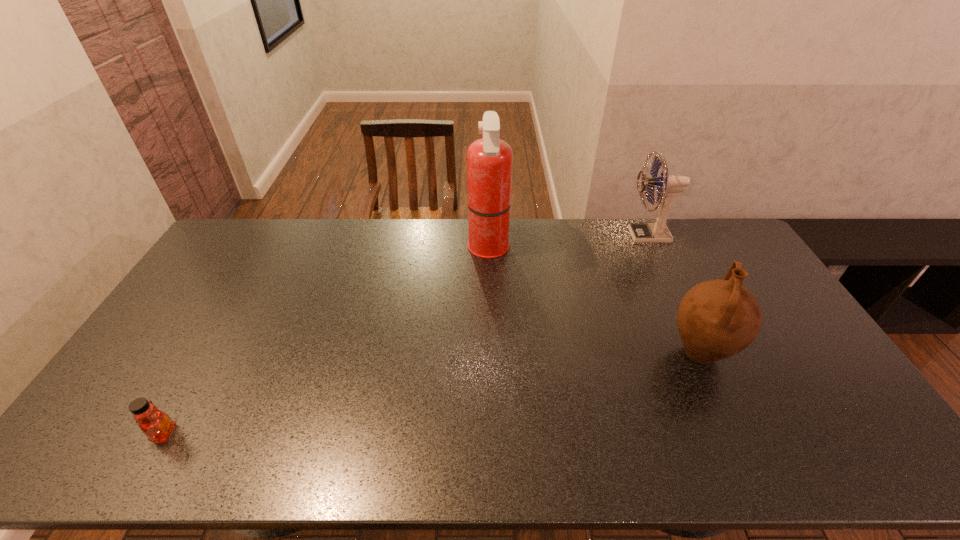
Identify the location of fire extinguisher. The height and width of the screenshot is (540, 960). (489, 160).

Image resolution: width=960 pixels, height=540 pixels. Find the location of `the tallest object`. the tallest object is located at coordinates (489, 160).

The image size is (960, 540). I want to click on fan, so click(x=670, y=185).

The image size is (960, 540). Find the location of `the second nearest object`. the second nearest object is located at coordinates (717, 319).

Find the location of `honey`. honey is located at coordinates (156, 425).

You are a GUI agent. You are given a task and a screenshot of the screen. Output one action in this format:
    pyautogui.click(x=<x>, y=<y>)
    Task: Click on the nearest object
    
    Given the screenshot: What is the action you would take?
    pyautogui.click(x=156, y=425)

Locate an element on the screen. The width and height of the screenshot is (960, 540). vacant space located with the handle and hose on the second object from left to right is located at coordinates (394, 249).

Where is `free point located 0.160m with the handle and hose on the second object from left to right`? free point located 0.160m with the handle and hose on the second object from left to right is located at coordinates (423, 249).

Locate an element on the screen. This screenshot has width=960, height=540. free space located 0.180m with the handle and hose on the second object from left to right is located at coordinates (419, 249).

You are a GUI agent. You are given a task and a screenshot of the screen. Output one action in this format:
    pyautogui.click(x=<x>, y=<y>)
    Task: Click on the free spot located on the front-facing side of the fan
    This screenshot has height=540, width=960.
    Given the screenshot: What is the action you would take?
    pyautogui.click(x=569, y=235)